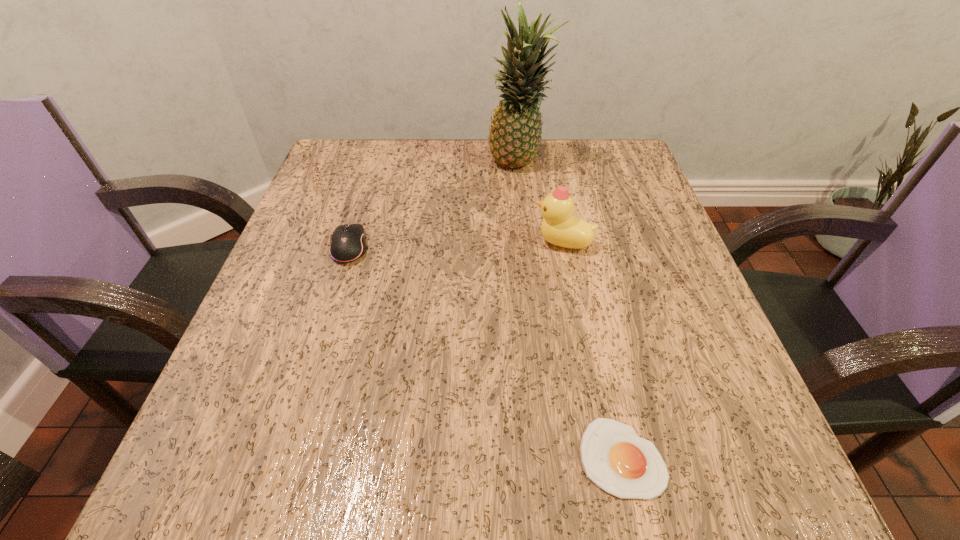
Identify the location of vacant space at the left edge of the desktop. The width and height of the screenshot is (960, 540). (319, 396).

The height and width of the screenshot is (540, 960). In order to click on vacant area at the right edge of the desktop in this screenshot , I will do `click(658, 380)`.

This screenshot has height=540, width=960. In the image, there is a desktop. Identify the location of vacant space at the near left corner. 297,485.

Identify the location of blank space at the far right corner of the desktop. This screenshot has width=960, height=540. (588, 192).

You are a GUI agent. You are given a task and a screenshot of the screen. Output one action in this format:
    pyautogui.click(x=<x>, y=<y>)
    Task: Click on the free spot at the near right corner of the desktop
    The width and height of the screenshot is (960, 540).
    Given the screenshot: What is the action you would take?
    pyautogui.click(x=724, y=462)

Identify the location of free space between the shortest object and the leftmost object. (486, 352).

Identify the location of blank region between the duckling and the shortest object. The width and height of the screenshot is (960, 540). (592, 350).

Image resolution: width=960 pixels, height=540 pixels. In order to click on vacant area that lies between the third shortest object and the nearest object in this screenshot , I will do `click(592, 350)`.

You are a GUI agent. You are given a task and a screenshot of the screen. Output one action in this format:
    pyautogui.click(x=<x>, y=<y>)
    Task: Click on the unoccupied position between the duckling and the leftmost object
    Image resolution: width=960 pixels, height=540 pixels.
    Given the screenshot: What is the action you would take?
    pyautogui.click(x=456, y=245)

Where is `unoccupied position between the egg yolk and the computer mouse`? The width and height of the screenshot is (960, 540). unoccupied position between the egg yolk and the computer mouse is located at coordinates (486, 352).